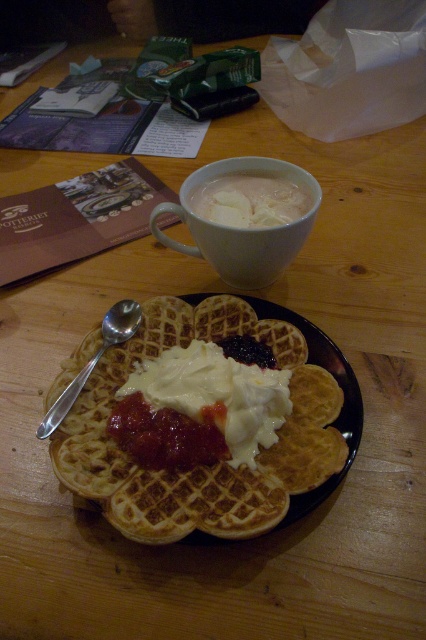
Is point (307, 365) positioned in front of point (250, 209)?

Yes, it is in front of point (250, 209).

Where is `golden brown waffle at center`? golden brown waffle at center is located at coordinates (213, 461).

The image size is (426, 640). What do you see at coordinates (213, 461) in the screenshot?
I see `golden brown waffle at center` at bounding box center [213, 461].

This screenshot has width=426, height=640. Identify the location of golden brown waffle at center. (213, 461).

Is golden brown waffle at center below silver metallic spoon at left?

Yes.

Can you confirm if golden brown waffle at center is taller than silver metallic spoon at left?

Yes.

Does point (313, 368) come farther from viewer compared to point (138, 310)?

No.

In order to click on golden brown waffle at center in this screenshot , I will do `click(213, 461)`.

Between white matte mug at upper center and silver metallic spoon at left, which one has more height?

With more height is white matte mug at upper center.

Consider the image. Who is lower down, white matte mug at upper center or silver metallic spoon at left?

silver metallic spoon at left is lower down.

Is point (250, 257) closer to camera compared to point (108, 348)?

No, (250, 257) is further to viewer.

Find the location of a particular element. white matte mug at upper center is located at coordinates (244, 218).